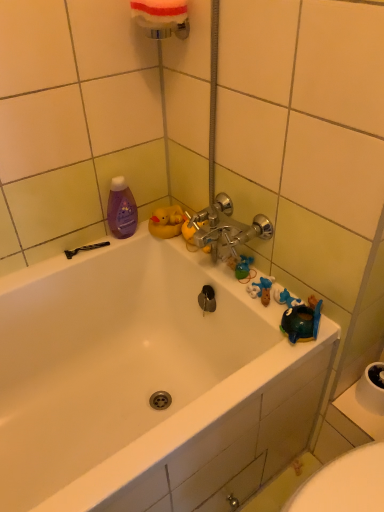
Question: From the image's perspective, is white glossy bathtub at upper center above white foam sponge at upper center?

Choices:
 (A) yes
 (B) no

Answer: (B)

Question: Considering the relative positions of white glossy bathtub at upper center and white foam sponge at upper center in the image provided, is white glossy bathtub at upper center to the left of white foam sponge at upper center from the viewer's perspective?

Choices:
 (A) yes
 (B) no

Answer: (A)

Question: From a real-world perspective, is white glossy bathtub at upper center beneath white foam sponge at upper center?

Choices:
 (A) yes
 (B) no

Answer: (A)

Question: Are white glossy bathtub at upper center and white foam sponge at upper center located far from each other?

Choices:
 (A) yes
 (B) no

Answer: (B)

Question: From the image's perspective, would you say white glossy bathtub at upper center is shown under white foam sponge at upper center?

Choices:
 (A) no
 (B) yes

Answer: (B)

Question: From a real-world perspective, relative to white foam sponge at upper center, is black plastic razor at lower left vertically above or below?

Choices:
 (A) below
 (B) above

Answer: (A)

Question: Is black plastic razor at lower left taller or shorter than white foam sponge at upper center?

Choices:
 (A) short
 (B) tall

Answer: (A)

Question: Looking at their shapes, would you say black plastic razor at lower left is wider or thinner than white foam sponge at upper center?

Choices:
 (A) wide
 (B) thin

Answer: (B)

Question: Considering the positions of point (97, 247) and point (157, 10), is point (97, 247) closer or farther from the camera than point (157, 10)?

Choices:
 (A) closer
 (B) farther

Answer: (B)

Question: Is black plastic razor at lower left to the left or to the right of purple glossy bottle at upper left in the image?

Choices:
 (A) left
 (B) right

Answer: (A)

Question: In terms of width, does black plastic razor at lower left look wider or thinner when compared to purple glossy bottle at upper left?

Choices:
 (A) wide
 (B) thin

Answer: (B)

Question: From a real-world perspective, is black plastic razor at lower left above or below purple glossy bottle at upper left?

Choices:
 (A) below
 (B) above

Answer: (A)

Question: Is black plastic razor at lower left in front of or behind purple glossy bottle at upper left in the image?

Choices:
 (A) behind
 (B) front

Answer: (A)

Question: From a real-world perspective, is purple glossy bottle at upper left above or below black plastic razor at lower left?

Choices:
 (A) above
 (B) below

Answer: (A)

Question: Visually, is purple glossy bottle at upper left positioned to the left or to the right of black plastic razor at lower left?

Choices:
 (A) left
 (B) right

Answer: (B)